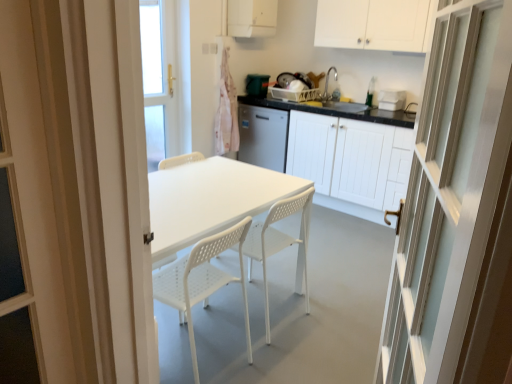
Question: Is white plastic container at upper right, the 1th appliance from the bottom, not close to white plastic chair at center, which is the second chair in right-to-left order?

Choices:
 (A) no
 (B) yes

Answer: (B)

Question: Is white plastic container at upper right, which is the 1th appliance from right to left, wider than white plastic chair at center, which is the second chair in right-to-left order?

Choices:
 (A) no
 (B) yes

Answer: (A)

Question: From the image's perspective, does white plastic container at upper right, which is the 1th appliance from right to left, appear higher than white plastic chair at center, the 1th chair in the left-to-right sequence?

Choices:
 (A) yes
 (B) no

Answer: (A)

Question: Does white plastic container at upper right, arranged as the second appliance when viewed from the back, appear on the right side of white plastic chair at center, which is the second chair in right-to-left order?

Choices:
 (A) yes
 (B) no

Answer: (A)

Question: From a real-world perspective, is white plastic container at upper right, the 1th appliance from the bottom, physically above white plastic chair at center, the 1th chair in the left-to-right sequence?

Choices:
 (A) no
 (B) yes

Answer: (B)

Question: Visually, is white plastic chair at center, the 1th chair in the left-to-right sequence, positioned to the left or to the right of white matte cabinet at upper center, the second cabinetry positioned from the top?

Choices:
 (A) left
 (B) right

Answer: (A)

Question: Choose the correct answer: Is white plastic chair at center, the 1th chair in the left-to-right sequence, inside white matte cabinet at upper center, the second cabinetry positioned from the top, or outside it?

Choices:
 (A) outside
 (B) inside

Answer: (A)

Question: Does point (168, 281) appear closer or farther from the camera than point (345, 34)?

Choices:
 (A) farther
 (B) closer

Answer: (B)

Question: In the image, is white plastic chair at center, which is the second chair in right-to-left order, positioned in front of or behind white matte cabinet at upper center, the second cabinetry positioned from the top?

Choices:
 (A) behind
 (B) front

Answer: (B)

Question: Is point (283, 243) closer or farther from the camera than point (401, 99)?

Choices:
 (A) farther
 (B) closer

Answer: (B)

Question: Is white plastic chair at center, which is the 1th chair from right to left, taller or shorter than white plastic container at upper right, the 2th appliance from the left?

Choices:
 (A) short
 (B) tall

Answer: (B)

Question: Is white plastic chair at center, which appears as the second chair when viewed from the left, bigger or smaller than white plastic container at upper right, the 1th appliance from the bottom?

Choices:
 (A) small
 (B) big

Answer: (B)

Question: Do you think white plastic chair at center, which appears as the second chair when viewed from the left, is within white plastic container at upper right, which is the 1th appliance from right to left, or outside of it?

Choices:
 (A) outside
 (B) inside

Answer: (A)

Question: From the image's perspective, is white matte cabinet at upper center, the second cabinetry positioned from the top, positioned above or below white plastic chair at center, which is the 1th chair from right to left?

Choices:
 (A) below
 (B) above

Answer: (B)

Question: Do you think white matte cabinet at upper center, the second cabinetry positioned from the top, is within white plastic chair at center, which appears as the second chair when viewed from the left, or outside of it?

Choices:
 (A) inside
 (B) outside

Answer: (B)